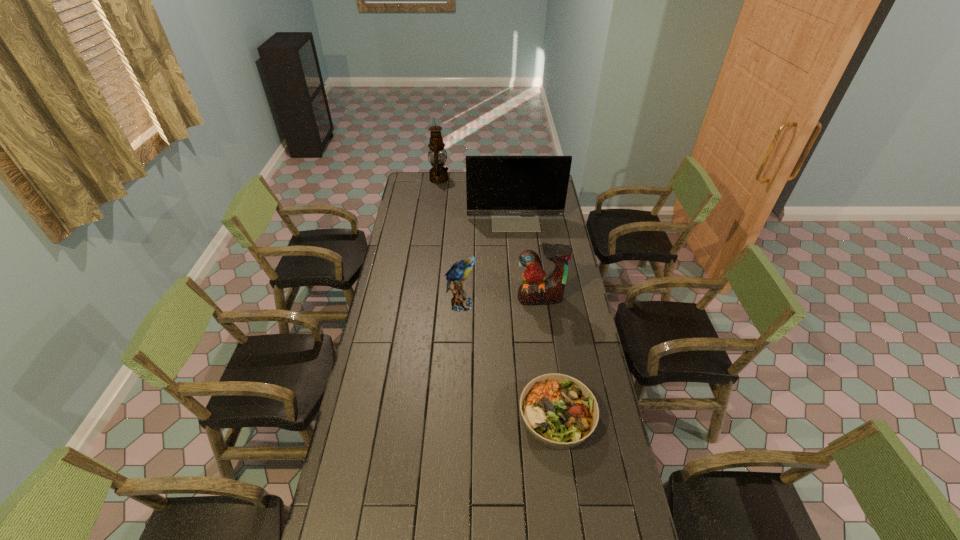
Image resolution: width=960 pixels, height=540 pixels. Identify the location of oil lamp. (438, 174).

Where is `the leftmost object`? This screenshot has width=960, height=540. the leftmost object is located at coordinates (438, 174).

At what (x,y) coordinates should I click in order to perform the action: click on the fourth nearest object. Please return your answer as a coordinate pair (x, y). Looking at the image, I should click on (514, 190).

Identify the location of the right parrot. Image resolution: width=960 pixels, height=540 pixels. (535, 290).

You are a GUI agent. You are given a task and a screenshot of the screen. Output one action in this format:
    pyautogui.click(x=<x>, y=<y>)
    Task: Click on the left parrot
    The width and height of the screenshot is (960, 540).
    Given the screenshot: What is the action you would take?
    pyautogui.click(x=459, y=271)

This screenshot has height=540, width=960. I want to click on salad plate, so click(x=559, y=412).

Locate an element on the screen. The width and height of the screenshot is (960, 540). the nearest object is located at coordinates (559, 412).

Locate an element on the screen. This screenshot has width=960, height=540. free space located on the right of the leftmost object is located at coordinates (488, 179).

At what (x,y) coordinates should I click in order to perform the action: click on free space located 0.370m on the screen of the second farthest object. Please return your answer as a coordinate pair (x, y). The width and height of the screenshot is (960, 540). Looking at the image, I should click on (521, 280).

Where is `vacant point located 0.370m at the face of the right parrot`? The image size is (960, 540). vacant point located 0.370m at the face of the right parrot is located at coordinates (551, 376).